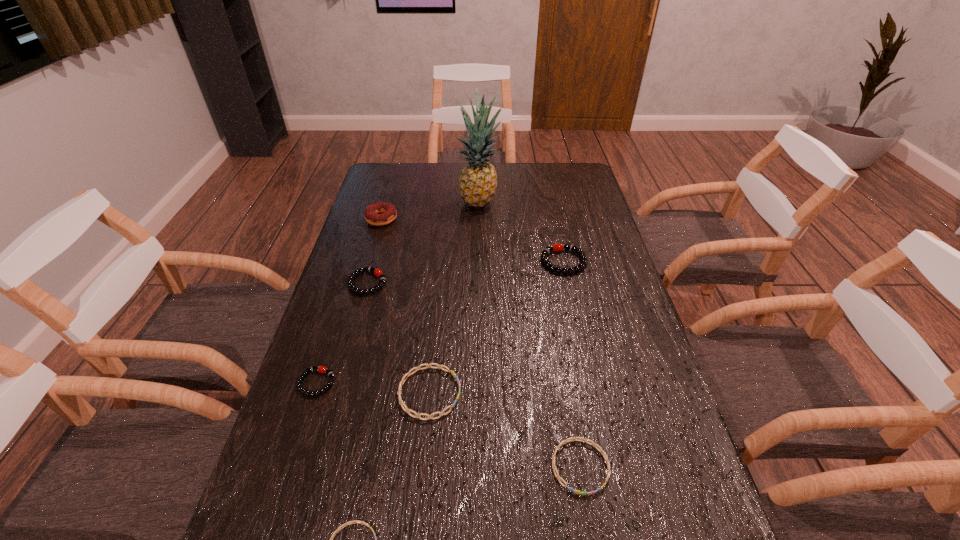
The height and width of the screenshot is (540, 960). I want to click on the closest blue bracelet to the biggest black bracelet, so click(408, 374).

Locate which blue bracelet is the second closest to the second smallest blue bracelet. Please provide its 2D coordinates. Your answer should be formatted as a tuple, i.e. [(x, y)], where the tuple contains the x and y coordinates of a point satisfying the conditions above.

[(354, 521)]